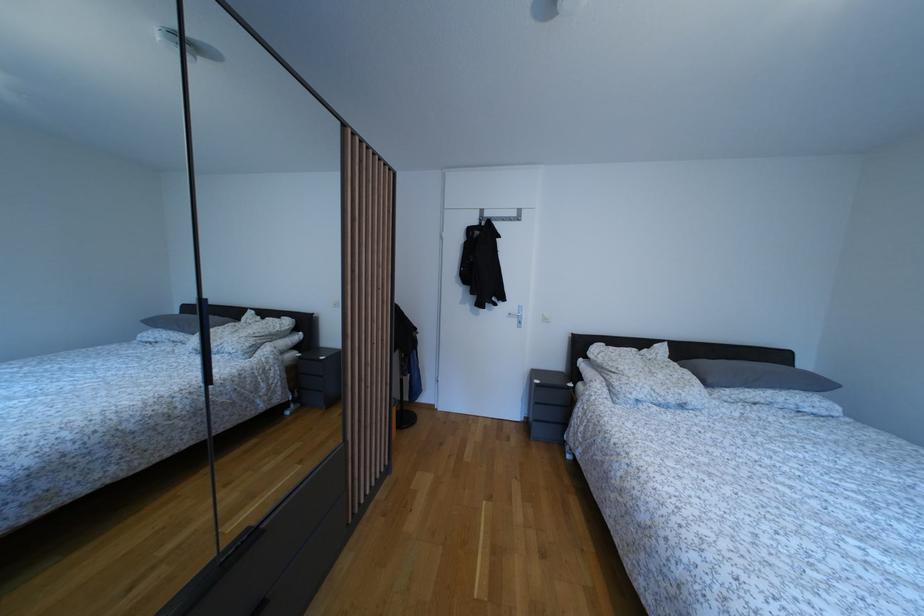
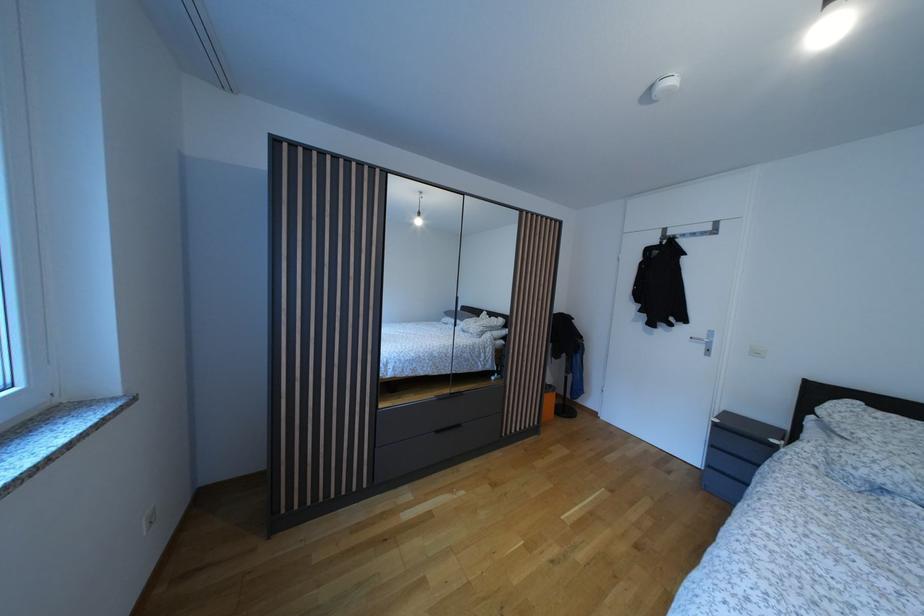
Where in the second image is the point corresponding to [521,317] from the first image?

(709, 342)